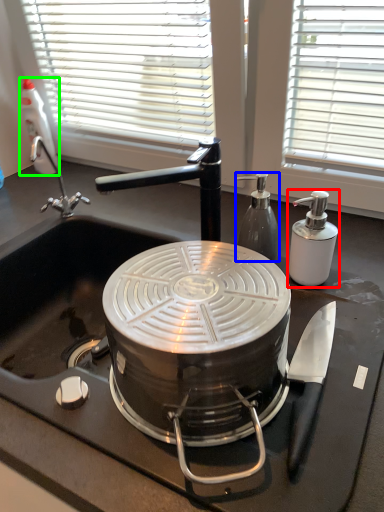
Question: Estimate the real-world distances between objects in this image. Which object is farther from kitchen appliance (highlighted by a red box), kitchen appliance (highlighted by a blue box) or bottle (highlighted by a green box)?

Choices:
 (A) kitchen appliance
 (B) bottle

Answer: (B)